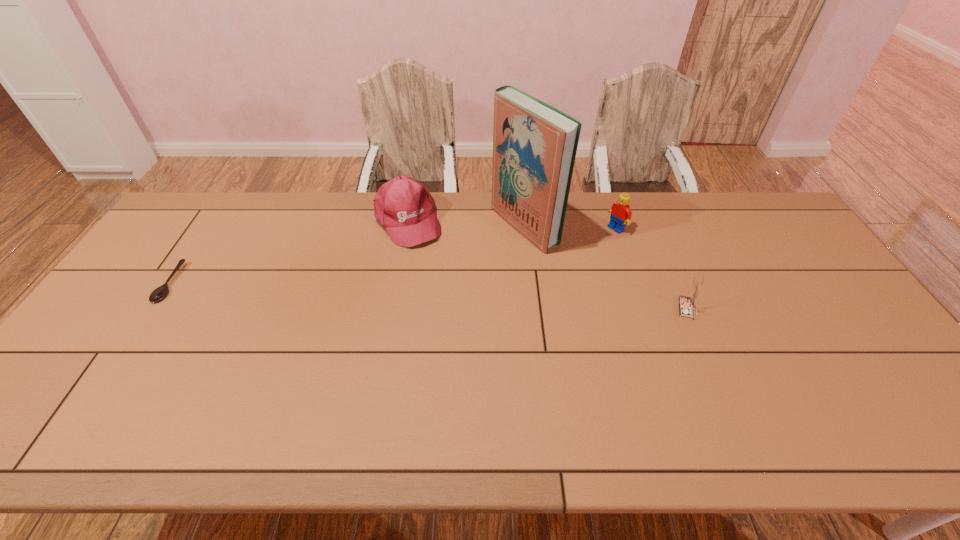
Locate an element on the screen. free space on the desktop that is between the leftmost object and the matchbox and is positioned at the front of the second object from left to right with the brim is located at coordinates (453, 297).

Locate an element on the screen. The image size is (960, 540). vacant space on the desktop that is between the soupspoon and the rightmost object and is positioned on the cover of the hardback book is located at coordinates (386, 294).

Locate an element on the screen. free space on the desktop that is between the leftmost object and the rightmost object and is positioned on the face of the Lego is located at coordinates pyautogui.click(x=497, y=299).